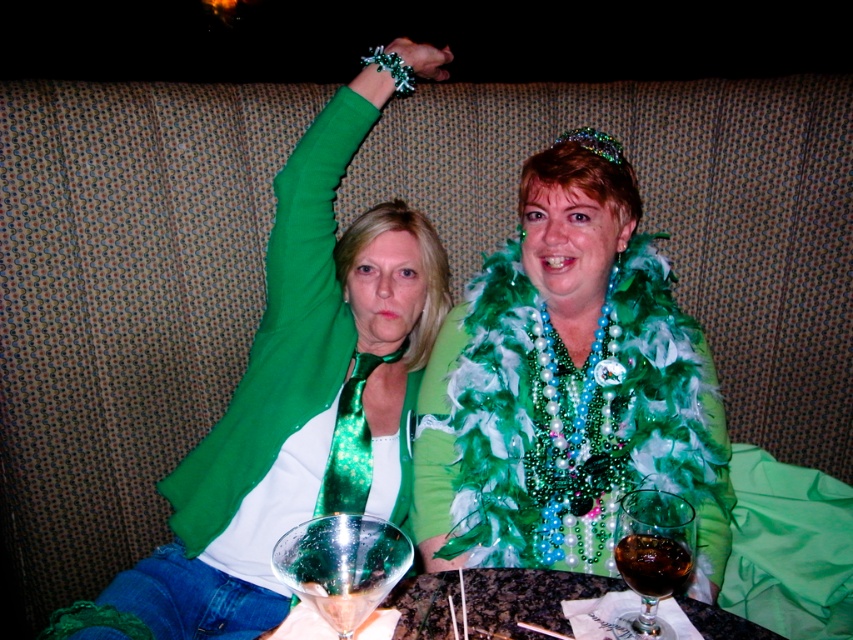
You are a photographer setting up for a group photo. You need to ensure that the matte green scarf at upper center and the dark glass wine at lower center are both visible in the frame. Based on their positions, which object is closer to the left edge of the photo?

The matte green scarf at upper center is positioned on the left side of the dark glass wine at lower center, so it is closer to the left edge of the photo.

You are a photographer taking a portrait of the two people on the couch. You want to place a small light source at the point with coordinates point (299, 392). According to the scene description, where exactly will this light source be placed?

The point (299, 392) is on the matte green scarf at upper center, so the light source will be placed on the matte green scarf at upper center.